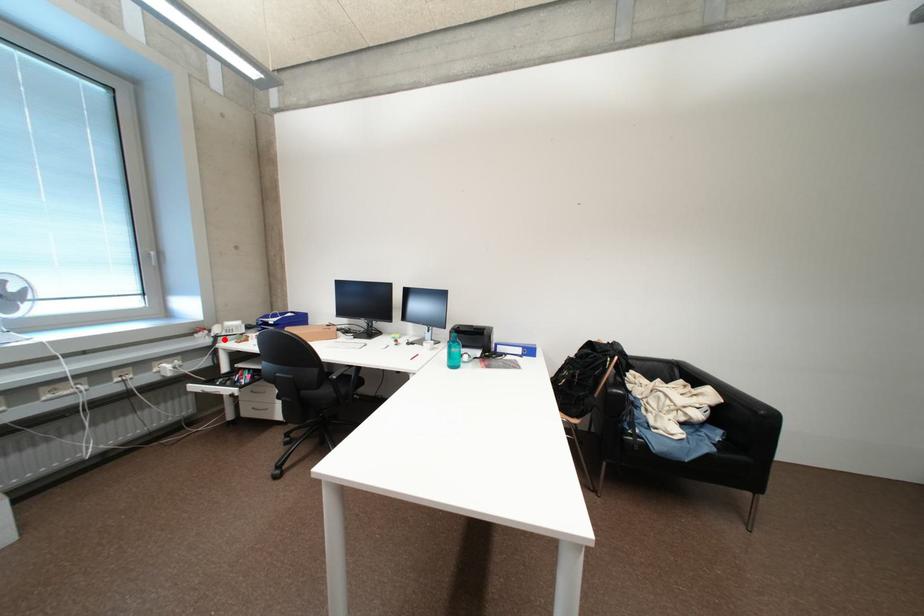
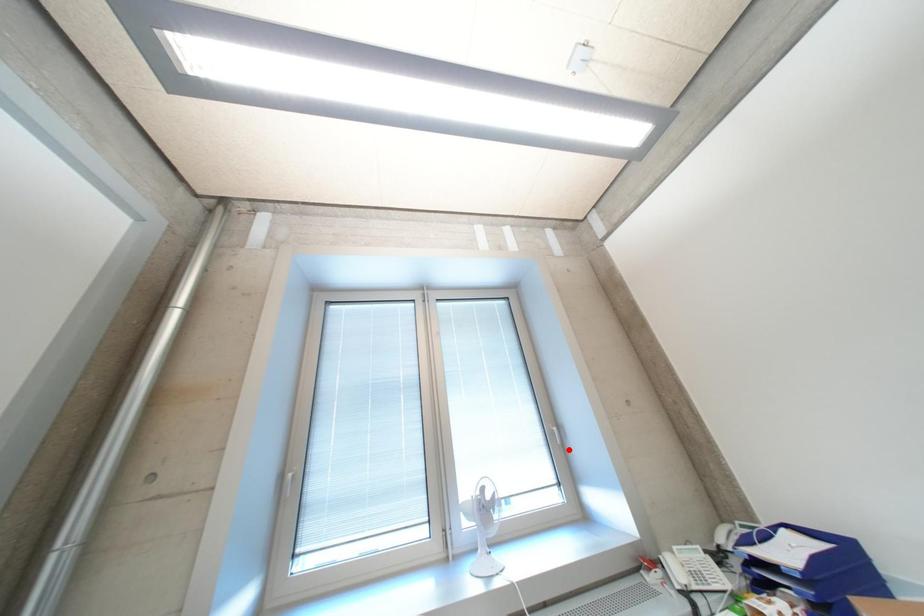
I am providing you with two images of the same scene from different viewpoints. A red point is marked on the first image and another point is marked on the second image. Is the red point in image1 aligned with the point shown in image2?

No